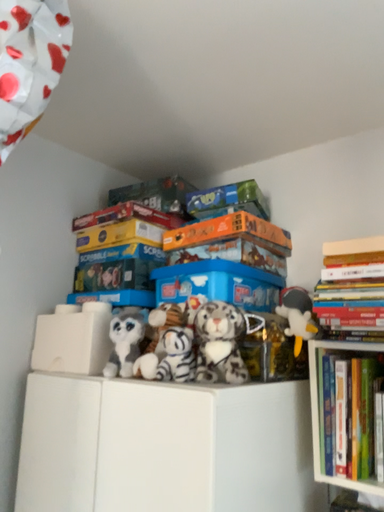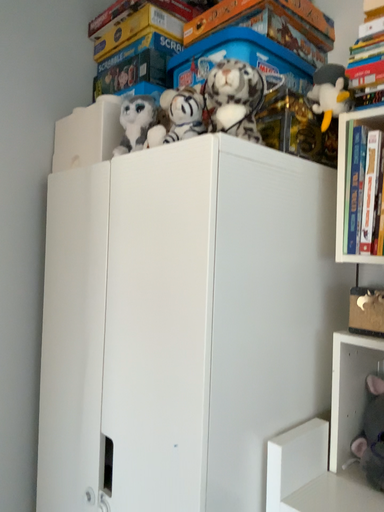
Question: Which way did the camera rotate in the video?

Choices:
 (A) rotated left
 (B) rotated right

Answer: (A)